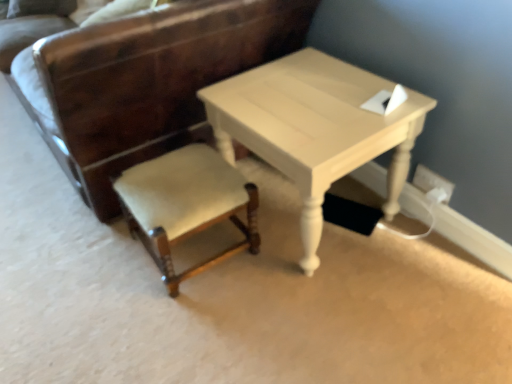
The image size is (512, 384). I want to click on blank space situated above velvet beige stool at center, which appears as the 1th chair when ordered from the bottom (from a real-world perspective), so click(x=175, y=182).